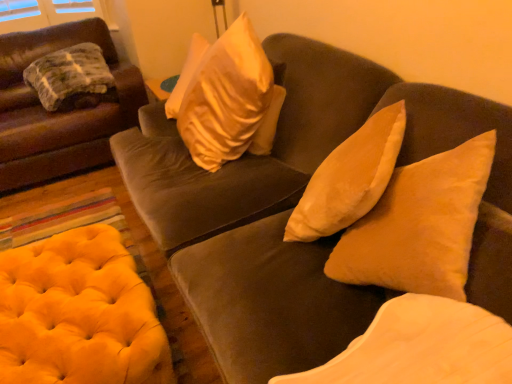
Where is `free location above yellow tufted ottoman at lower left (from a real-world perspective)`? This screenshot has width=512, height=384. free location above yellow tufted ottoman at lower left (from a real-world perspective) is located at coordinates (55, 287).